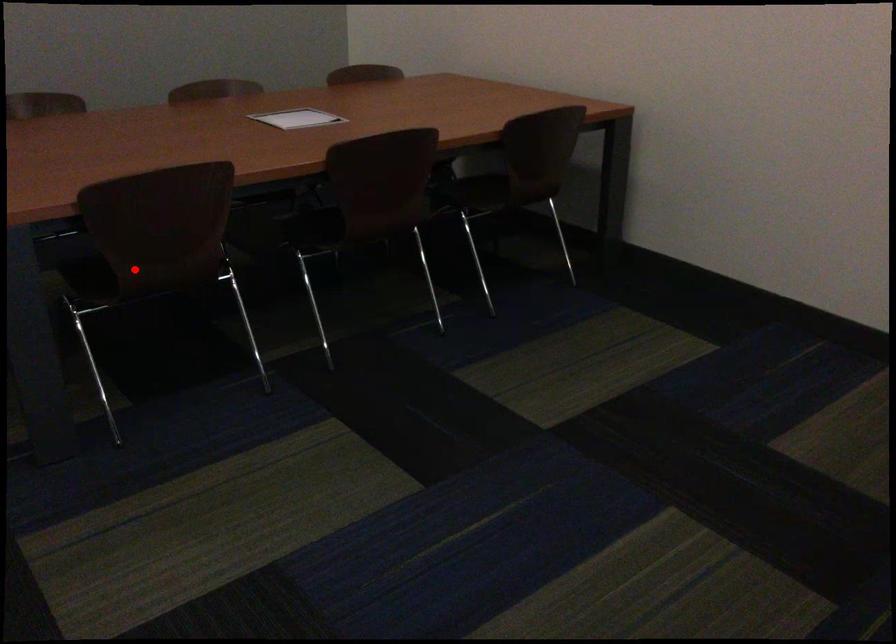
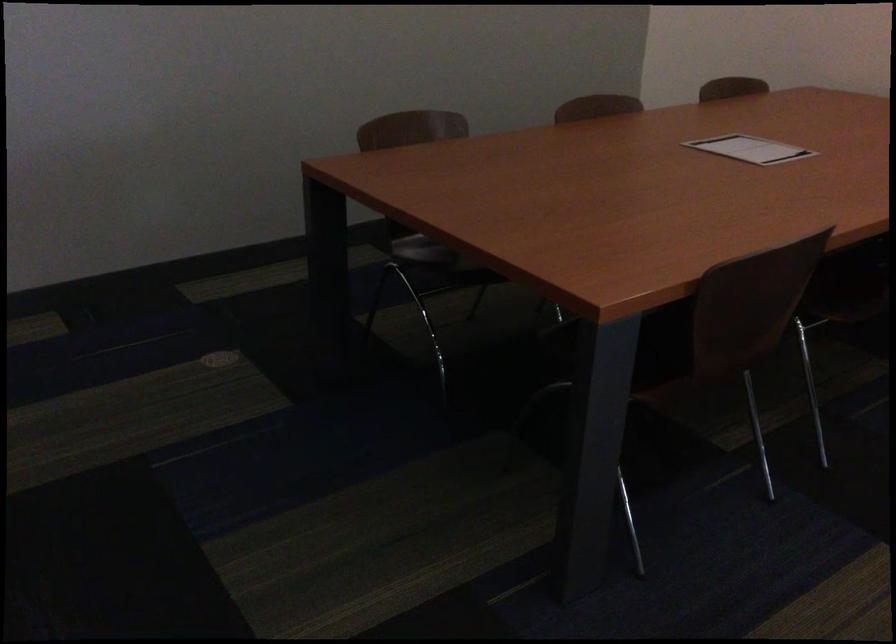
Question: I am providing you with two images of the same scene from different viewpoints. Given a red point in image1, look at the same physical point in image2. Is it:

Choices:
 (A) Closer to the viewpoint
 (B) Farther from the viewpoint

Answer: (A)